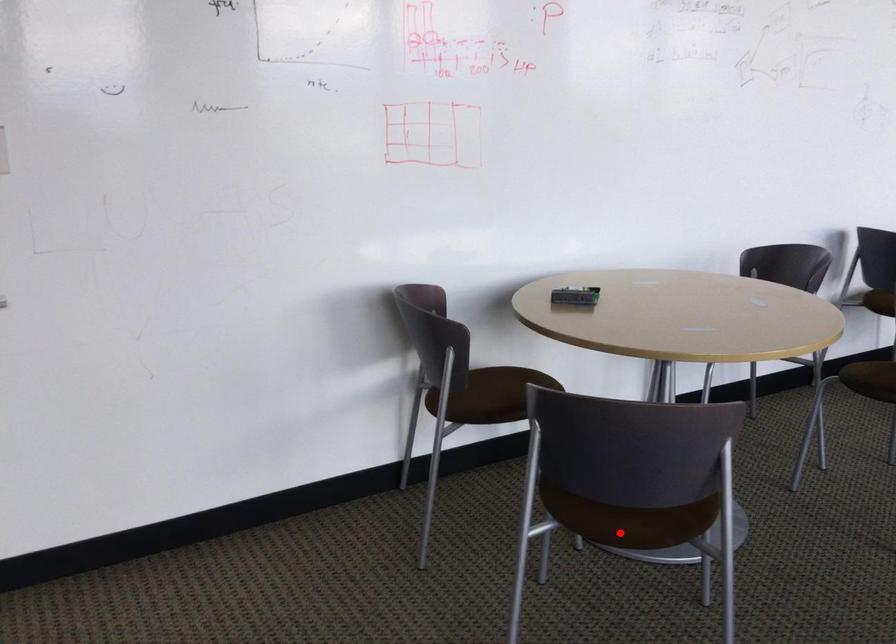
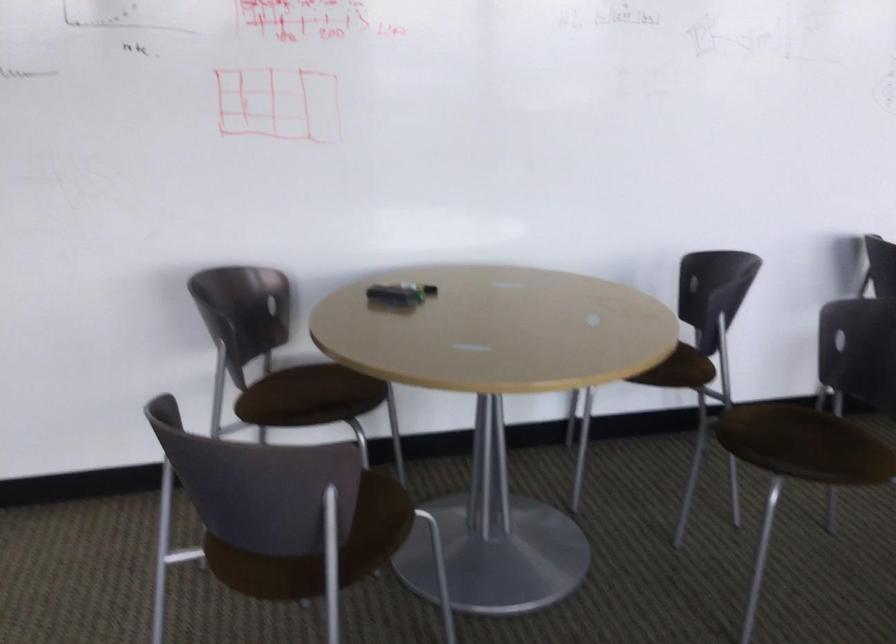
Question: I am providing you with two images of the same scene from different viewpoints. Given a red point in image1, look at the same physical point in image2. Is it:

Choices:
 (A) Closer to the viewpoint
 (B) Farther from the viewpoint

Answer: (A)